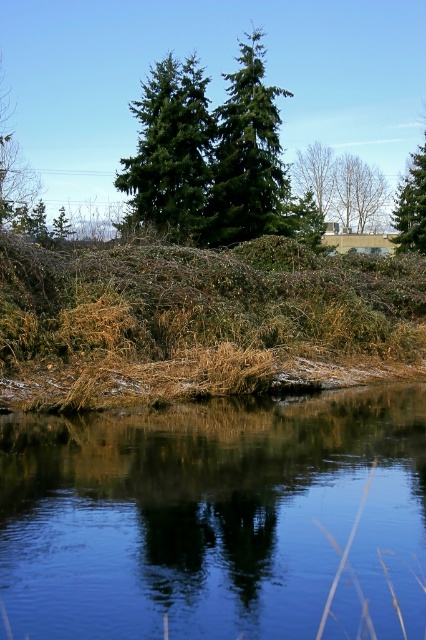
Question: Is green matte tree at center thinner than green matte tree at upper right?

Choices:
 (A) yes
 (B) no

Answer: (A)

Question: Which object is farther from the camera taking this photo?

Choices:
 (A) green matte tree at center
 (B) clear water at lower center
 (C) brown leafy tree at upper center

Answer: (C)

Question: Estimate the real-world distances between objects in this image. Which object is farther from the green matte tree at upper right?

Choices:
 (A) brown leafy tree at upper center
 (B) clear water at lower center
 (C) green matte evergreen tree at upper center

Answer: (B)

Question: Does clear water at lower center appear under green matte tree at center?

Choices:
 (A) yes
 (B) no

Answer: (A)

Question: Which object is closer to the camera taking this photo?

Choices:
 (A) clear water at lower center
 (B) green matte tree at center
 (C) green matte tree at upper right
 (D) green matte evergreen tree at upper center

Answer: (A)

Question: Can you confirm if green matte tree at upper right is smaller than brown leafy tree at upper center?

Choices:
 (A) yes
 (B) no

Answer: (B)